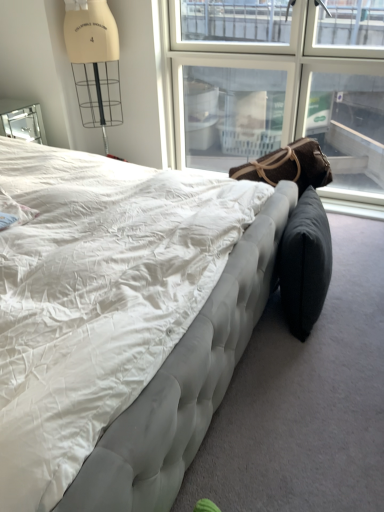
Question: Is point (43, 422) closer or farther from the camera than point (319, 177)?

Choices:
 (A) farther
 (B) closer

Answer: (B)

Question: In the image, is tufted fabric bed at center positioned in front of or behind brown fabric bean bag at center, the 1th bean bag chair viewed from the top?

Choices:
 (A) behind
 (B) front

Answer: (B)

Question: Considering the real-world distances, which object is closest to the tufted fabric bed at center?

Choices:
 (A) brown fabric bean bag at center, which ranks as the second bean bag chair in bottom-to-top order
 (B) transparent glass window at upper right
 (C) black fabric bean bag chair at lower right, arranged as the first bean bag chair when ordered from the bottom

Answer: (C)

Question: Which object is the farthest from the brown fabric bean bag at center, which ranks as the second bean bag chair in bottom-to-top order?

Choices:
 (A) black fabric bean bag chair at lower right, the 2th bean bag chair from the top
 (B) tufted fabric bed at center
 (C) transparent glass window at upper right

Answer: (C)